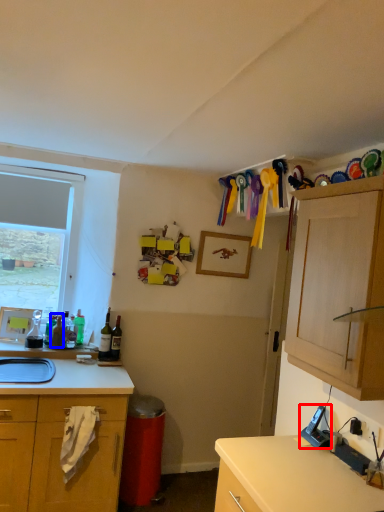
Question: Which object is closer to the camera taking this photo, appliance (highlighted by a red box) or bottle (highlighted by a blue box)?

Choices:
 (A) appliance
 (B) bottle

Answer: (A)